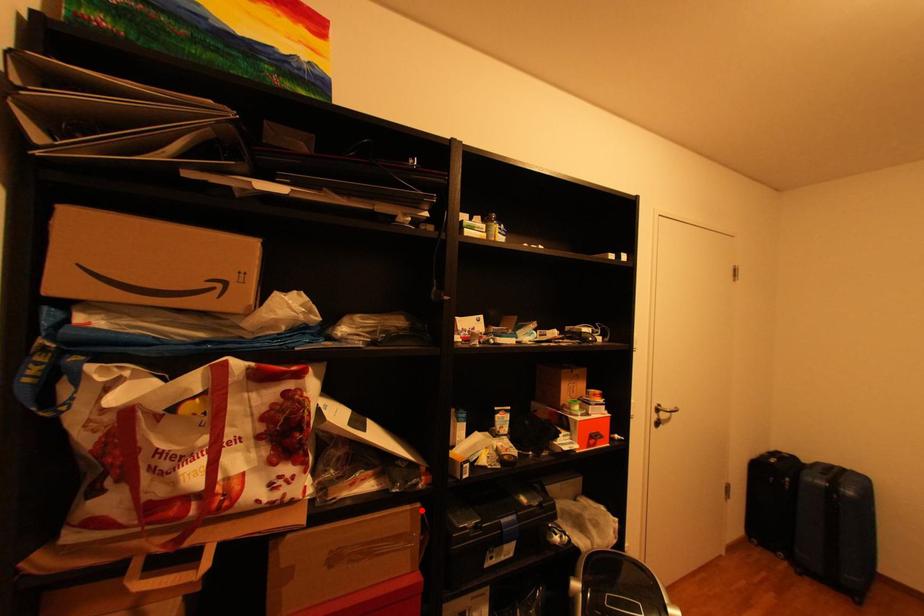
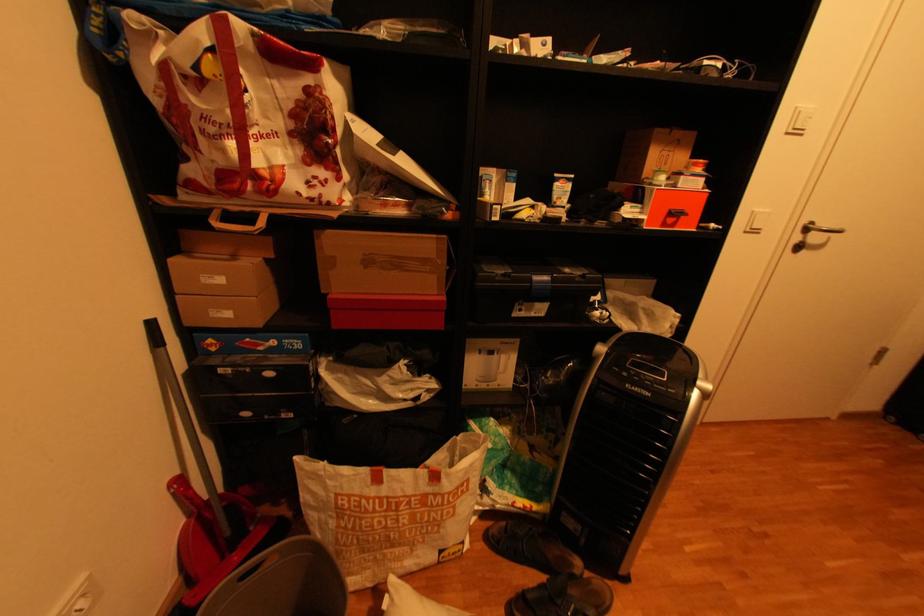
Where in the second image is the point corresponding to the highlighted location from the first image?

(446, 238)